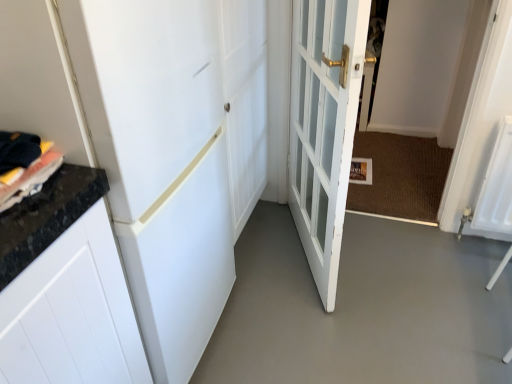
Question: Is white glass door at center, the second door positioned from the left, bigger than gray smooth concrete at center?

Choices:
 (A) no
 (B) yes

Answer: (B)

Question: From the image's perspective, is white glass door at center, which appears as the 1th door when viewed from the right, below gray smooth concrete at center?

Choices:
 (A) no
 (B) yes

Answer: (A)

Question: Is white glass door at center, which appears as the 1th door when viewed from the right, positioned with its back to gray smooth concrete at center?

Choices:
 (A) no
 (B) yes

Answer: (A)

Question: Does white glass door at center, which appears as the 1th door when viewed from the right, have a smaller size compared to gray smooth concrete at center?

Choices:
 (A) yes
 (B) no

Answer: (B)

Question: Can you confirm if white glass door at center, the second door positioned from the left, is wider than gray smooth concrete at center?

Choices:
 (A) yes
 (B) no

Answer: (B)

Question: Is point (317, 269) closer or farther from the camera than point (173, 309)?

Choices:
 (A) closer
 (B) farther

Answer: (B)

Question: Considering the relative positions of white glass door at center, which appears as the 1th door when viewed from the right, and white matte door at upper left, which is counted as the second door, starting from the right, in the image provided, is white glass door at center, which appears as the 1th door when viewed from the right, to the left or to the right of white matte door at upper left, which is counted as the second door, starting from the right,?

Choices:
 (A) right
 (B) left

Answer: (A)

Question: From the image's perspective, is white glass door at center, which appears as the 1th door when viewed from the right, above or below white matte door at upper left, positioned as the first door in left-to-right order?

Choices:
 (A) below
 (B) above

Answer: (B)

Question: Is white glass door at center, the second door positioned from the left, situated inside white matte door at upper left, which is counted as the second door, starting from the right, or outside?

Choices:
 (A) inside
 (B) outside

Answer: (B)

Question: From the image's perspective, is gray smooth concrete at center located above or below white glass door at center, the second door positioned from the left?

Choices:
 (A) below
 (B) above

Answer: (A)

Question: Looking at their shapes, would you say gray smooth concrete at center is wider or thinner than white glass door at center, which appears as the 1th door when viewed from the right?

Choices:
 (A) wide
 (B) thin

Answer: (A)

Question: Choose the correct answer: Is gray smooth concrete at center inside white glass door at center, the second door positioned from the left, or outside it?

Choices:
 (A) outside
 (B) inside

Answer: (A)

Question: In the image, is gray smooth concrete at center on the left side or the right side of white glass door at center, the second door positioned from the left?

Choices:
 (A) left
 (B) right

Answer: (B)

Question: From a real-world perspective, is gray smooth concrete at center positioned above or below white matte door at upper left, positioned as the first door in left-to-right order?

Choices:
 (A) below
 (B) above

Answer: (A)

Question: In the image, is gray smooth concrete at center on the left side or the right side of white matte door at upper left, which is counted as the second door, starting from the right?

Choices:
 (A) right
 (B) left

Answer: (A)